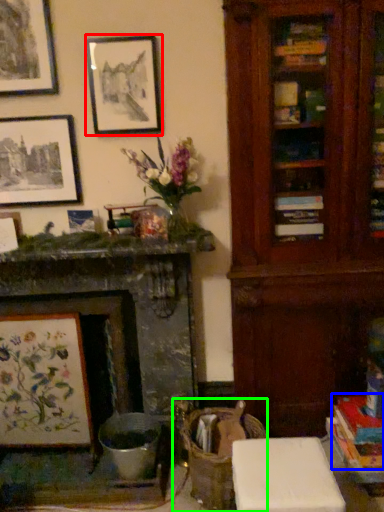
Question: Which object is the closest to the picture frame (highlighted by a red box)? Choose among these: book (highlighted by a blue box) or swivel chair (highlighted by a green box).

Choices:
 (A) book
 (B) swivel chair

Answer: (B)